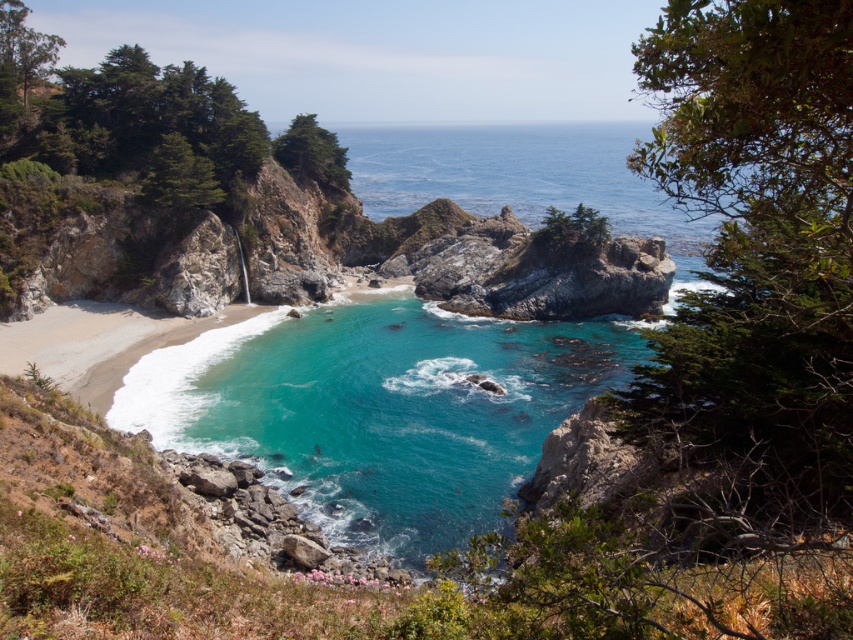
You are a photographer planning to capture the coastal scene. You notice two types of water areas in the image. Which one has a smaller area, the turquoise glossy water at center or the clear blue water at center?

The turquoise glossy water at center is smaller than the clear blue water at center according to the description.

You are a marine biologist studying water depth variations in the coastal area. You observe the turquoise glossy water at center and the clear blue water at center. Based on their positions, which of these two waters is closer to the shore?

The turquoise glossy water at center is closer to the shore than the clear blue water at center because it is positioned at a distance of 461.32 feet from the clear blue water at center, indicating it is nearer to the shore.